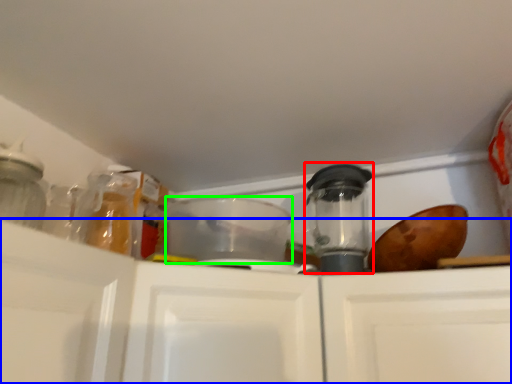
Question: Which object is the closest to the appliance (highlighted by a red box)? Choose among these: cabinetry (highlighted by a blue box) or appliance (highlighted by a green box).

Choices:
 (A) cabinetry
 (B) appliance

Answer: (B)